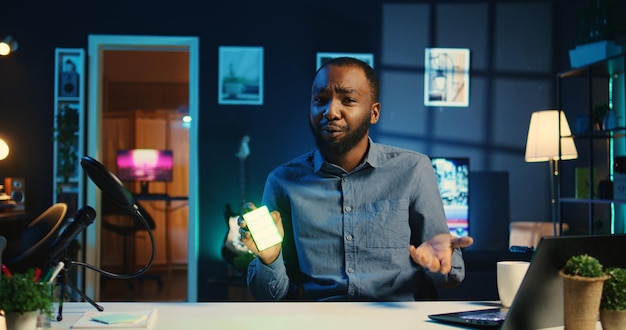
You are a GUI agent. You are given a task and a screenshot of the screen. Output one action in this format:
    pyautogui.click(x=<x>, y=<y>)
    Task: Click on the doorway
    
    Given the screenshot: What is the action you would take?
    pyautogui.click(x=192, y=47)